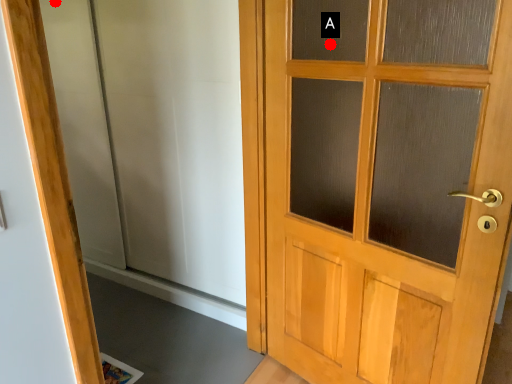
Question: Two points are circled on the image, labeled by A and B beside each circle. Which point appears farthest from the camera in this image?

Choices:
 (A) A is further
 (B) B is further

Answer: (B)